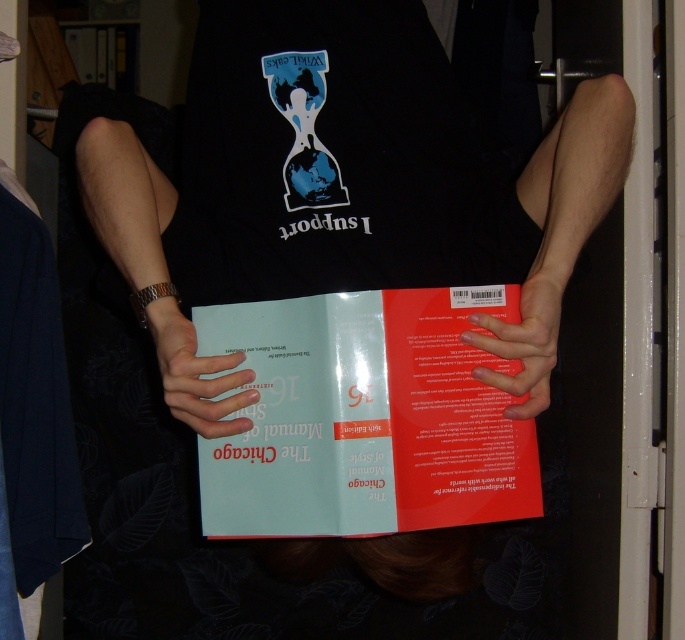
Question: Which point appears farthest from the camera in this image?

Choices:
 (A) (551, 300)
 (B) (225, 508)

Answer: (B)

Question: Can you confirm if matte paper book at center is positioned above white matte paper at center?

Choices:
 (A) yes
 (B) no

Answer: (B)

Question: Considering the real-world distances, which object is closest to the white matte paper at center?

Choices:
 (A) matte paper book at center
 (B) smooth matte skin at center

Answer: (A)

Question: Is matte paper book at center thinner than smooth matte skin at center?

Choices:
 (A) no
 (B) yes

Answer: (A)

Question: Is white matte paper at center behind smooth matte skin at center?

Choices:
 (A) yes
 (B) no

Answer: (A)

Question: Estimate the real-world distances between objects in this image. Which object is closer to the white matte paper at center?

Choices:
 (A) smooth matte skin at center
 (B) matte paper book at center

Answer: (B)